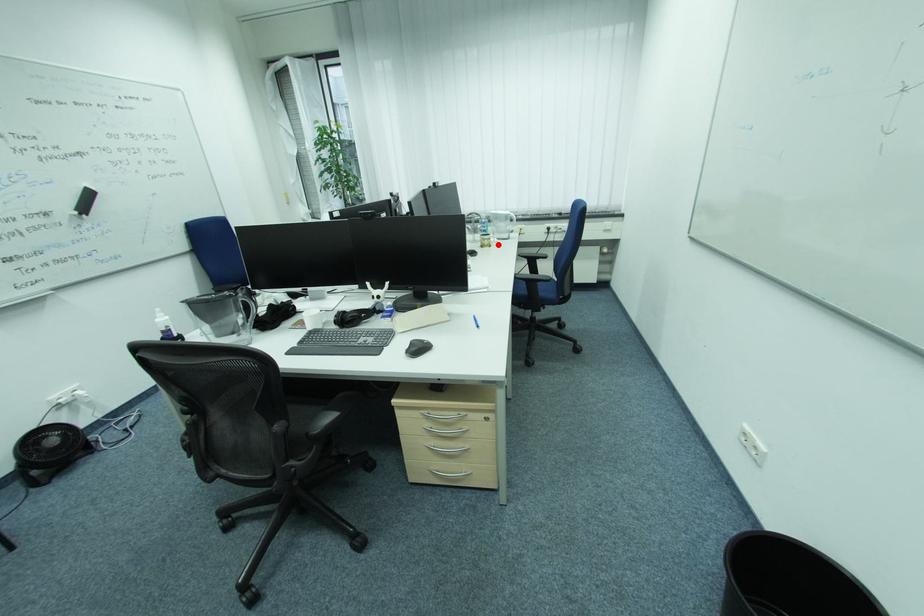
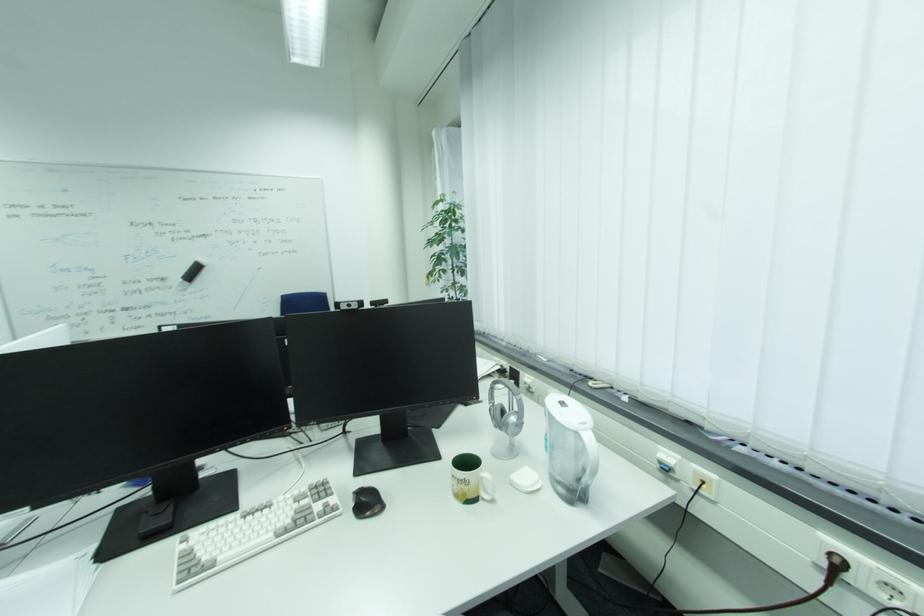
Question: I am providing you with two images of the same scene from different viewpoints. Image1 has a red point marked. In image2, the corresponding 3D location appears at what relative position? Reply with the corresponding letter.

Choices:
 (A) Closer
 (B) Farther

Answer: (B)